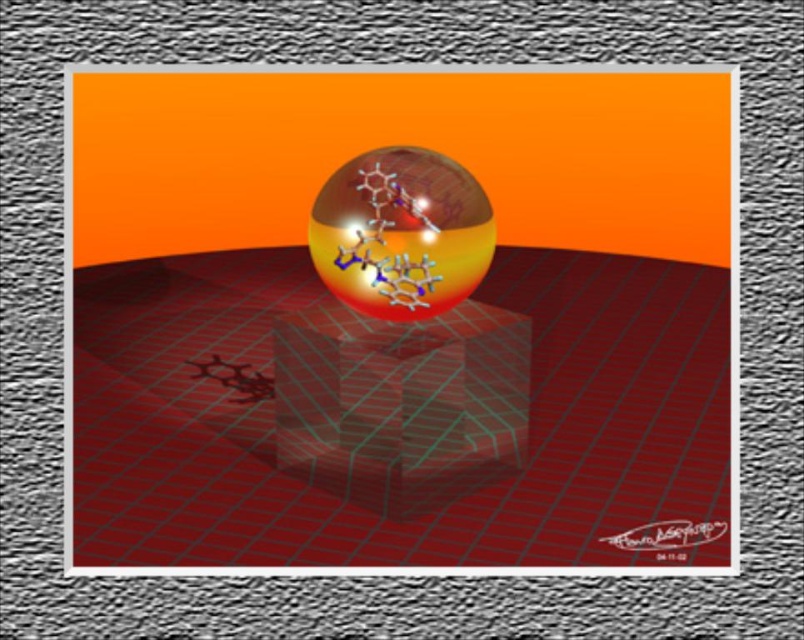
Question: Is transparent glass cube at center to the right of transparent glass sphere at center from the viewer's perspective?

Choices:
 (A) yes
 (B) no

Answer: (A)

Question: Can you confirm if transparent glass cube at center is positioned to the right of transparent glass sphere at center?

Choices:
 (A) yes
 (B) no

Answer: (A)

Question: Which object is closer to the camera taking this photo?

Choices:
 (A) transparent glass sphere at center
 (B) transparent glass cube at center

Answer: (B)

Question: Which point appears farthest from the camera in this image?

Choices:
 (A) (359, 182)
 (B) (269, 292)

Answer: (B)

Question: Does transparent glass cube at center have a lesser width compared to transparent glass sphere at center?

Choices:
 (A) yes
 (B) no

Answer: (B)

Question: Which object appears closest to the camera in this image?

Choices:
 (A) transparent glass sphere at center
 (B) transparent glass cube at center

Answer: (B)